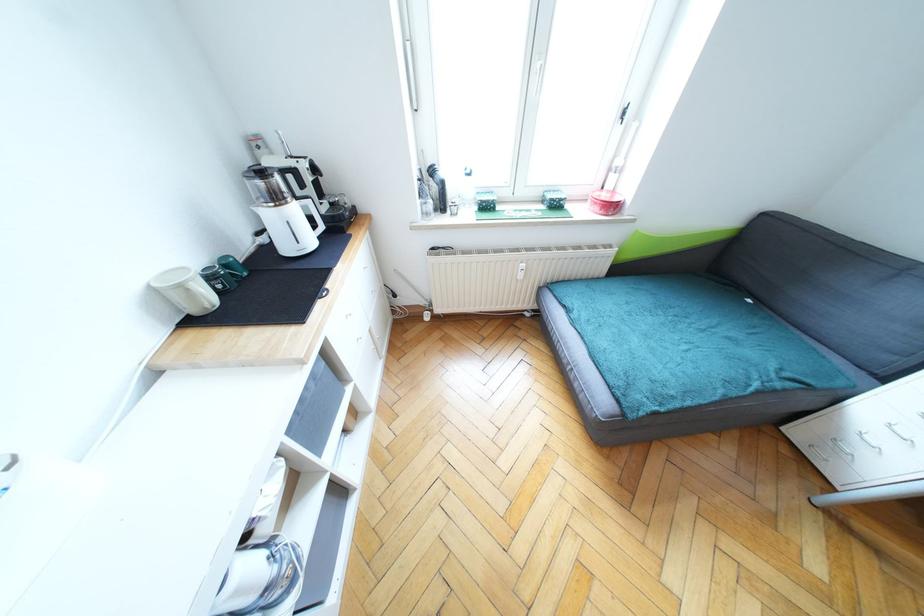
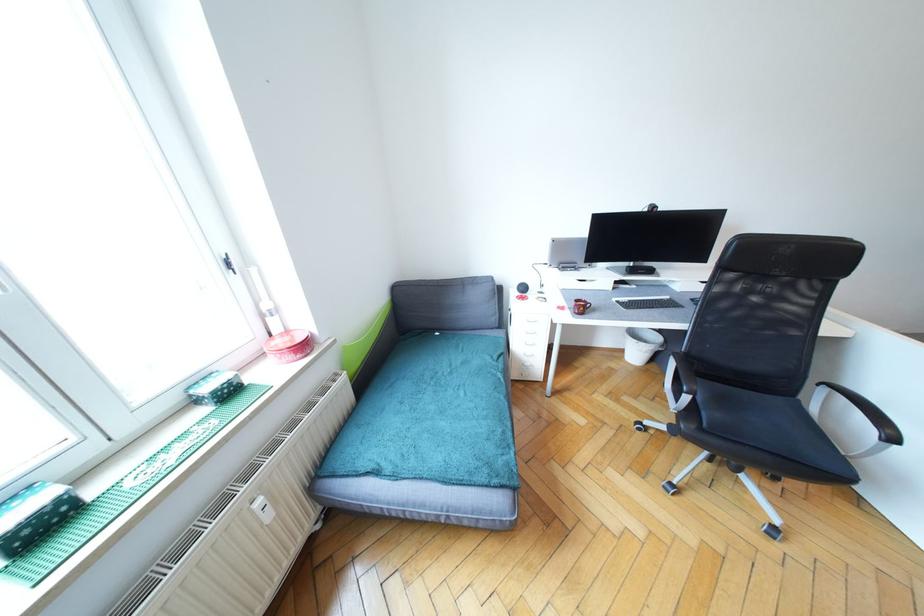
Find the pixel in the second image that matches (524,277) in the first image.

(272, 517)